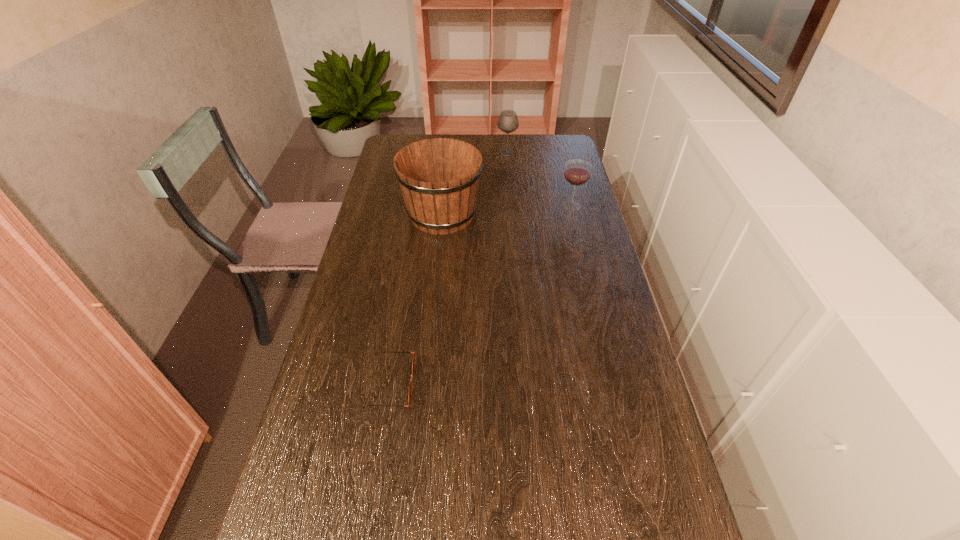
The width and height of the screenshot is (960, 540). I want to click on object that is the second closest to the farthest object, so click(577, 172).

Identify the location of free space that satisfies the following two spatial constraints: 1. on the front side of the right wineglass; 2. on the right side of the third object from left to right. The height and width of the screenshot is (540, 960). (512, 205).

Locate an element on the screen. The image size is (960, 540). free location that satisfies the following two spatial constraints: 1. on the front side of the farther wineglass; 2. on the right side of the right wineglass is located at coordinates (512, 205).

Identify the location of free space that satisfies the following two spatial constraints: 1. on the front side of the rightmost object; 2. on the face of the nearest object. The image size is (960, 540). (615, 383).

This screenshot has height=540, width=960. In order to click on free space in the image that satisfies the following two spatial constraints: 1. on the front side of the right wineglass; 2. on the face of the nearest object in this screenshot , I will do 615,383.